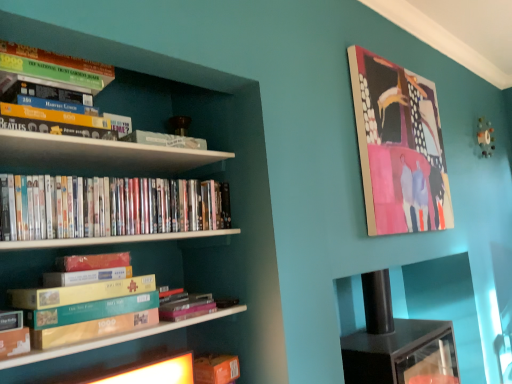
Question: Is green cardboard book at upper left, which appears as the first book when viewed from the top, looking in the opposite direction of white glossy bookshelf at left?

Choices:
 (A) yes
 (B) no

Answer: (A)

Question: Can you confirm if green cardboard book at upper left, which is counted as the fifth book, starting from the bottom, is thinner than white glossy bookshelf at left?

Choices:
 (A) no
 (B) yes

Answer: (B)

Question: Is white glossy bookshelf at left surrounded by green cardboard book at upper left, which appears as the first book when viewed from the top?

Choices:
 (A) no
 (B) yes

Answer: (A)

Question: Does green cardboard book at upper left, which appears as the first book when viewed from the top, lie behind white glossy bookshelf at left?

Choices:
 (A) yes
 (B) no

Answer: (A)

Question: Is green cardboard book at upper left, which is counted as the fifth book, starting from the bottom, taller than white glossy bookshelf at left?

Choices:
 (A) yes
 (B) no

Answer: (B)

Question: Is white glossy bookshelf at left inside the boundaries of hardcover book at center, placed as the 4th book when sorted from top to bottom, or outside?

Choices:
 (A) outside
 (B) inside

Answer: (A)

Question: Is white glossy bookshelf at left taller or shorter than hardcover book at center, placed as the 4th book when sorted from top to bottom?

Choices:
 (A) short
 (B) tall

Answer: (B)

Question: Considering the positions of point (257, 221) and point (174, 301), is point (257, 221) closer or farther from the camera than point (174, 301)?

Choices:
 (A) closer
 (B) farther

Answer: (A)

Question: In the image, is white glossy bookshelf at left on the left side or the right side of hardcover book at center, placed as the 4th book when sorted from top to bottom?

Choices:
 (A) left
 (B) right

Answer: (A)

Question: Is teal cardboard box at lower left, which is the third book from bottom to top, wider or thinner than matte wooden picture frame at upper right?

Choices:
 (A) wide
 (B) thin

Answer: (A)

Question: Considering the positions of teal cardboard box at lower left, which ranks as the 3th book in top-to-bottom order, and matte wooden picture frame at upper right in the image, is teal cardboard box at lower left, which ranks as the 3th book in top-to-bottom order, bigger or smaller than matte wooden picture frame at upper right?

Choices:
 (A) small
 (B) big

Answer: (A)

Question: Relative to matte wooden picture frame at upper right, is teal cardboard box at lower left, which ranks as the 3th book in top-to-bottom order, in front or behind?

Choices:
 (A) behind
 (B) front

Answer: (B)

Question: From a real-world perspective, relative to matte wooden picture frame at upper right, is teal cardboard box at lower left, which is the third book from bottom to top, vertically above or below?

Choices:
 (A) below
 (B) above

Answer: (A)

Question: Is teal cardboard box at lower left, which ranks as the 3th book in top-to-bottom order, taller or shorter than white glossy bookshelf at left?

Choices:
 (A) short
 (B) tall

Answer: (A)

Question: From the image's perspective, is teal cardboard box at lower left, which ranks as the 3th book in top-to-bottom order, above or below white glossy bookshelf at left?

Choices:
 (A) below
 (B) above

Answer: (A)